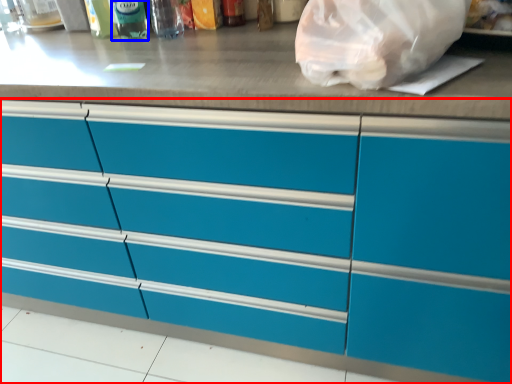
Question: Among these objects, which one is farthest to the camera, cabinetry (highlighted by a red box) or bottle (highlighted by a blue box)?

Choices:
 (A) cabinetry
 (B) bottle

Answer: (B)